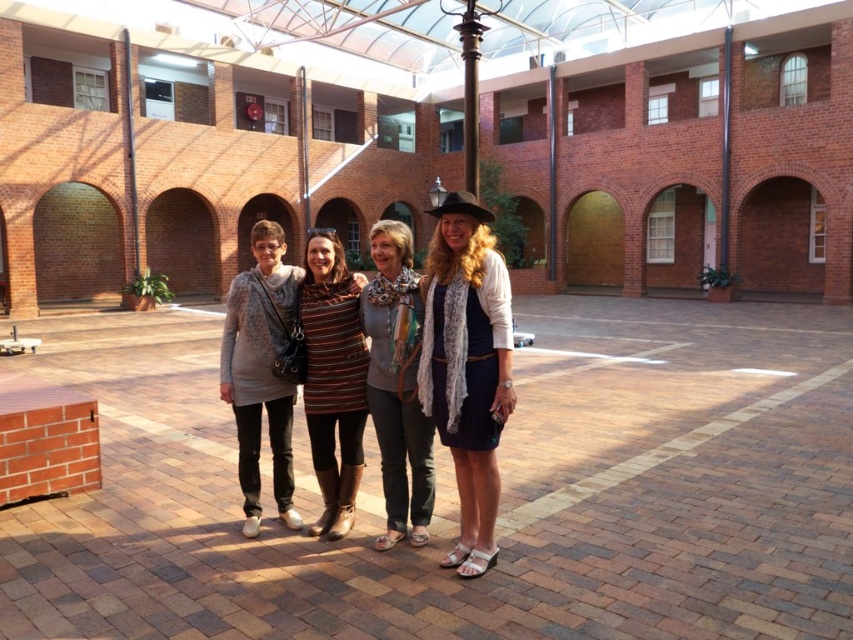
Question: Among these points, which one is nearest to the camera?

Choices:
 (A) (463, 259)
 (B) (323, 442)
 (C) (383, 464)

Answer: (A)

Question: Is white lace dress at center above striped fabric dress at center?

Choices:
 (A) no
 (B) yes

Answer: (B)

Question: Estimate the real-world distances between objects in this image. Which object is farther from the striped fabric dress at center?

Choices:
 (A) gray knit sweater at center
 (B) white lace dress at center

Answer: (B)

Question: Is white lace dress at center to the left of gray knit sweater at center from the viewer's perspective?

Choices:
 (A) no
 (B) yes

Answer: (A)

Question: Can you confirm if white lace dress at center is positioned below gray knit sweater at center?

Choices:
 (A) yes
 (B) no

Answer: (B)

Question: Which object is positioned farthest from the striped fabric dress at center?

Choices:
 (A) white lace dress at center
 (B) gray knit sweater at center

Answer: (A)